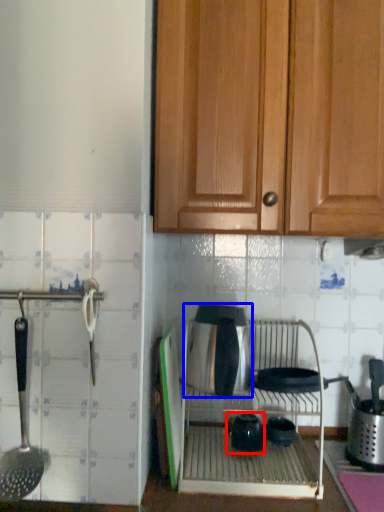
Question: Which of the following is the closest to the observer, tea pot (highlighted by a red box) or appliance (highlighted by a blue box)?

Choices:
 (A) tea pot
 (B) appliance

Answer: (B)